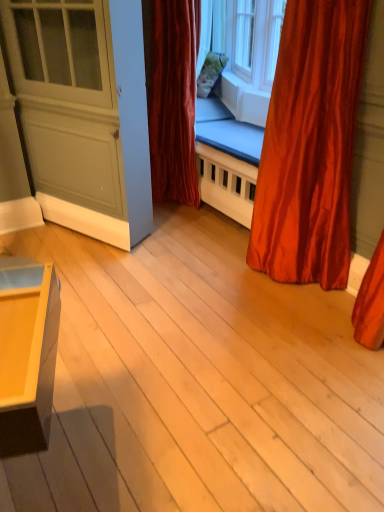
What are the coordinates of `vacant area that lies in front of satin red curtain at right, the second curtain from the left` in the screenshot? It's located at (290, 328).